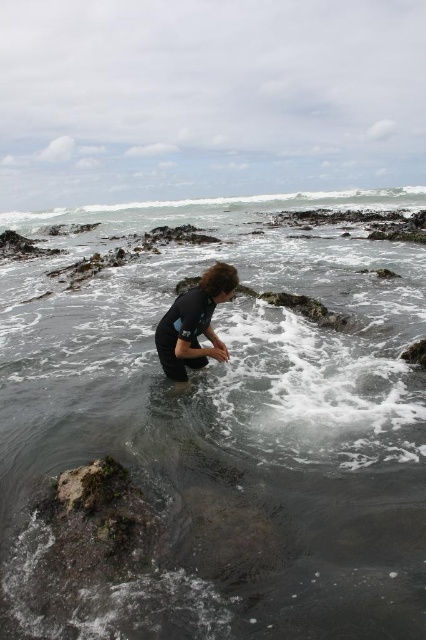
You are a drone operator trying to capture the best shot of the person in the coastal scene. You need to adjust your camera to focus on both the point at (348, 355) and the point at (195, 336). Which point should you focus on first to ensure the closer one is in sharp focus?

You should focus on point (195, 336) first because it is closer to the camera than point (348, 355), ensuring that the closer point is in sharp focus before adjusting for the farther one.

You are a marine biologist observing the coastal scene. You notice the clear water at center and the dark blue wetsuit at center. Which object occupies a larger area in the image?

The clear water at center is larger in size than the dark blue wetsuit at center, so the clear water at center occupies a larger area.

Consider the image. You are a marine biologist observing the coastal scene. You need to collect water samples from the clear water at center and the dark blue wetsuit at center. Which object is closer to you as you stand on the shore?

The clear water at center is closer to you because it is in front of the dark blue wetsuit at center, meaning the wetsuit is further away.